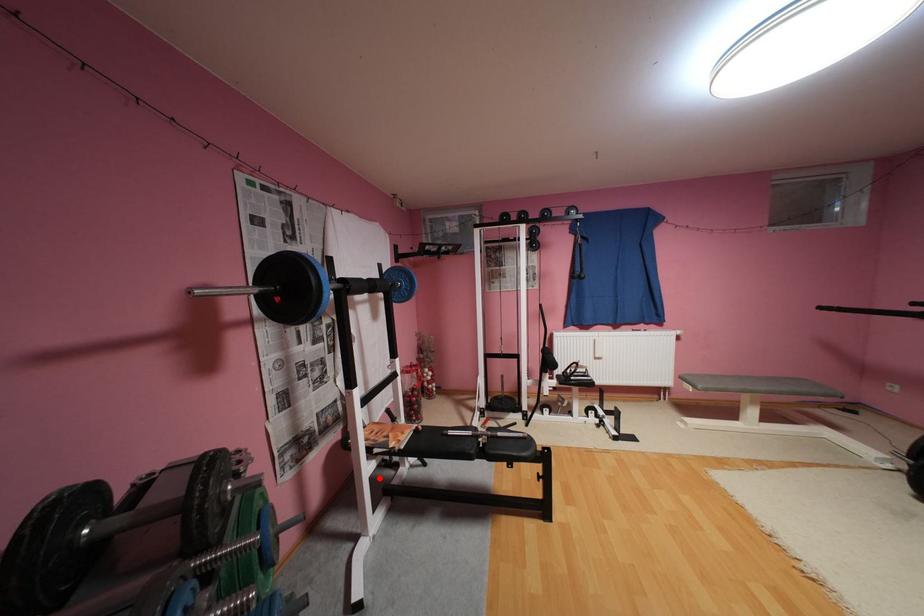
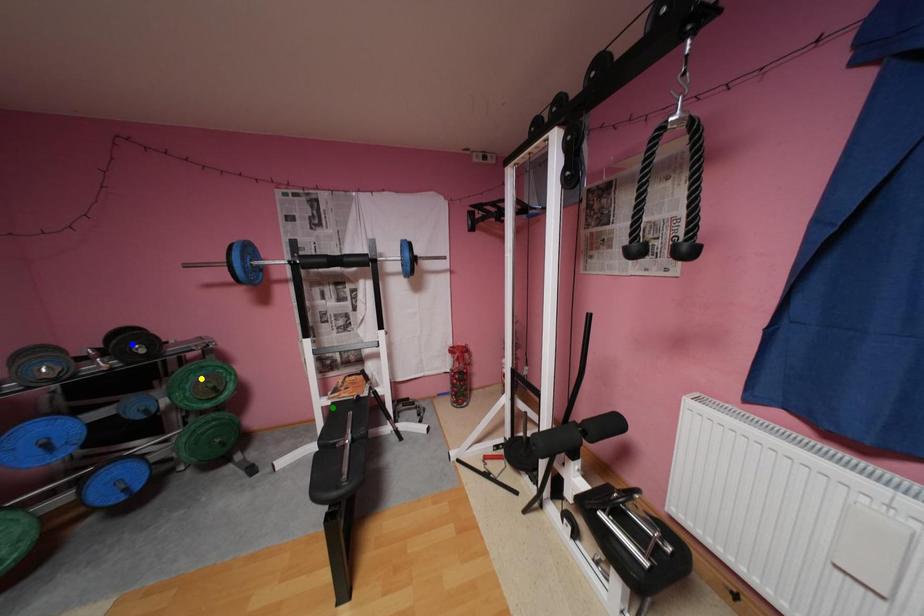
Question: I am providing you with two images of the same scene from different viewpoints. A red point is marked on the first image. You are given multiple points on the second image. Which point in image 2 is actually the same real-world point as the red point in image 1?

Choices:
 (A) green point
 (B) yellow point
 (C) blue point

Answer: (A)